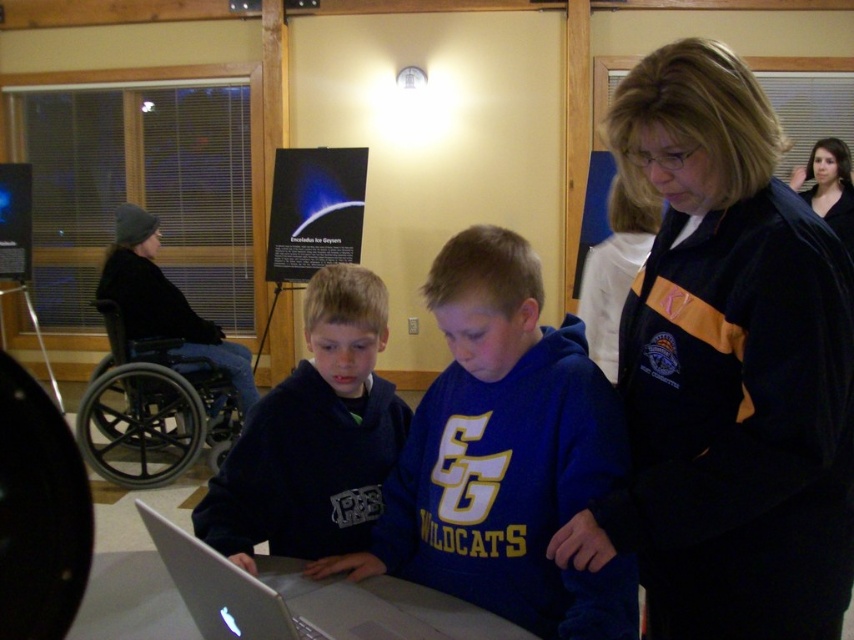
Question: In this image, where is black fleece jacket at upper right located relative to black plastic wheelchair at left?

Choices:
 (A) above
 (B) below

Answer: (A)

Question: Which is nearer to the black plastic wheelchair at left?

Choices:
 (A) silver metallic table at lower center
 (B) silver metallic laptop at center

Answer: (A)

Question: Which object is positioned farthest from the silver metallic table at lower center?

Choices:
 (A) black plastic wheelchair at left
 (B) smooth black hair at upper right
 (C) black fleece jacket at left
 (D) black fleece jacket at upper right

Answer: (B)

Question: Which point is closer to the camera?

Choices:
 (A) (151, 292)
 (B) (314, 524)
 (C) (241, 582)

Answer: (C)

Question: Can you confirm if dark blue hoodie at center is smaller than silver metallic laptop at center?

Choices:
 (A) yes
 (B) no

Answer: (B)

Question: Is silver metallic table at lower center bigger than smooth black hair at upper right?

Choices:
 (A) no
 (B) yes

Answer: (A)